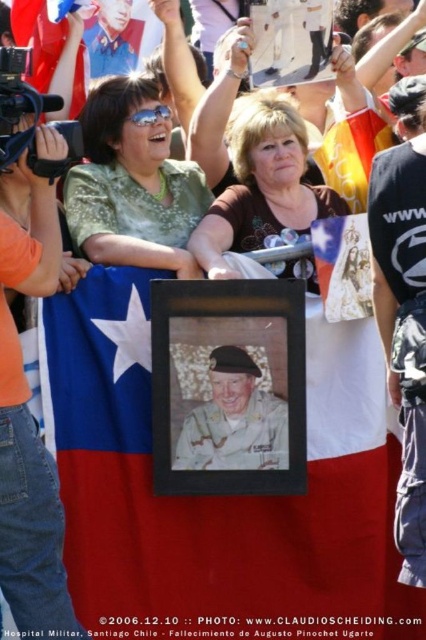
From the picture: You are at a commemorative event and notice a woman wearing sunglasses and a green patterned top. There is also a point marked at coordinates (262, 186). What is the color of the shirt located at the marked point?

The point at (262, 186) marks the brown matte shirt at center, so the shirt there is brown.

You are a photographer at the event and want to capture a photo that includes both the red fabric flag at center and the blue uniform at upper left. Based on their positions, will the flag be visible in the background or foreground of the uniform?

The red fabric flag at center is positioned under the blue uniform at upper left, so the flag will be in the foreground of the uniform.